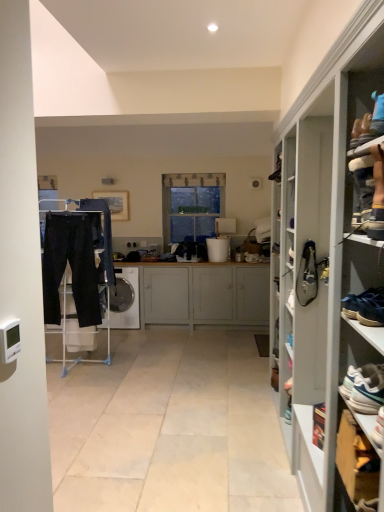
Find the location of `clear glass window at center`. clear glass window at center is located at coordinates (191, 205).

This screenshot has width=384, height=512. What do you see at coordinates (132, 304) in the screenshot?
I see `white glossy dishwasher at center` at bounding box center [132, 304].

This screenshot has height=512, width=384. I want to click on white matte cabinet at center, so click(204, 294).

You are a GUI agent. You are given a task and a screenshot of the screen. Output one action in this format:
    pyautogui.click(x=<x>, y=<y>)
    Task: Click on the black leather shoe at right, acting as the first shoe starting from the top
    
    Given the screenshot: What is the action you would take?
    pyautogui.click(x=307, y=275)

Looking at this image, which object is closer to the camera taking this photo, white matte cabinet at center or wooden cabinet at lower right?

Positioned in front is wooden cabinet at lower right.

From a real-world perspective, relative to wooden cabinet at lower right, is white matte cabinet at center vertically above or below?

white matte cabinet at center is situated lower than wooden cabinet at lower right in the real world.

How much distance is there between white matte cabinet at center and wooden cabinet at lower right?

white matte cabinet at center is 3.81 meters away from wooden cabinet at lower right.

From the picture: Between white matte cabinet at center and wooden cabinet at lower right, which one has smaller width?

wooden cabinet at lower right is thinner.

From a real-world perspective, who is located lower, white leather sneaker at lower right, the second shoe viewed from the top, or white glossy cupboard at right?

white leather sneaker at lower right, the second shoe viewed from the top, from a real-world perspective.

Considering the sizes of white leather sneaker at lower right, the second shoe viewed from the top, and white glossy cupboard at right in the image, is white leather sneaker at lower right, the second shoe viewed from the top, wider or thinner than white glossy cupboard at right?

Clearly, white leather sneaker at lower right, the second shoe viewed from the top, has less width compared to white glossy cupboard at right.

Considering the sizes of white leather sneaker at lower right, the first shoe in the bottom-to-top sequence, and white glossy cupboard at right in the image, is white leather sneaker at lower right, the first shoe in the bottom-to-top sequence, bigger or smaller than white glossy cupboard at right?

white leather sneaker at lower right, the first shoe in the bottom-to-top sequence, is smaller than white glossy cupboard at right.

Would you consider white leather sneaker at lower right, which appears as the first shoe when viewed from the front, to be distant from white glossy cupboard at right?

Yes, white leather sneaker at lower right, which appears as the first shoe when viewed from the front, is far from white glossy cupboard at right.

Which object is closer to the camera, white glossy dishwasher at center or white glossy cupboard at right?

white glossy cupboard at right is closer to the camera.

Does white glossy dishwasher at center have a lesser height compared to white glossy cupboard at right?

Yes.

The width and height of the screenshot is (384, 512). Identify the location of dish washer located on the left of white glossy cupboard at right. (132, 304).

Is white glossy dishwasher at center aimed at white glossy cupboard at right?

No, white glossy dishwasher at center is not aimed at white glossy cupboard at right.

Who is bigger, white glossy dishwasher at center or wooden cabinet at lower right?

Bigger between the two is white glossy dishwasher at center.

Is white glossy dishwasher at center aimed at wooden cabinet at lower right?

No, white glossy dishwasher at center is not turned towards wooden cabinet at lower right.

Looking at this image, is white glossy dishwasher at center at the left side of wooden cabinet at lower right?

Indeed, white glossy dishwasher at center is positioned on the left side of wooden cabinet at lower right.

Considering the points (346, 461) and (136, 270), which point is in front, point (346, 461) or point (136, 270)?

The point (346, 461) is more forward.

How much distance is there between wooden cabinet at lower right and white glossy dishwasher at center?

wooden cabinet at lower right is 3.89 meters from white glossy dishwasher at center.

Which of these two, wooden cabinet at lower right or white glossy dishwasher at center, is wider?

white glossy dishwasher at center.

Is wooden cabinet at lower right shorter than white glossy dishwasher at center?

Yes.

Is clear glass window at center wider than wooden cabinet at lower right?

Incorrect, the width of clear glass window at center does not surpass that of wooden cabinet at lower right.

From the image's perspective, would you say clear glass window at center is shown under wooden cabinet at lower right?

Actually, clear glass window at center appears above wooden cabinet at lower right in the image.

Is clear glass window at center bigger than wooden cabinet at lower right?

Indeed, clear glass window at center has a larger size compared to wooden cabinet at lower right.

Does clear glass window at center appear on the right side of wooden cabinet at lower right?

Incorrect, clear glass window at center is not on the right side of wooden cabinet at lower right.

From the image's perspective, relative to clear glass window at center, is black cotton trousers at left above or below?

black cotton trousers at left is situated lower than clear glass window at center in the image.

Looking at their sizes, would you say black cotton trousers at left is wider or thinner than clear glass window at center?

Considering their sizes, black cotton trousers at left looks broader than clear glass window at center.

Is black cotton trousers at left looking in the opposite direction of clear glass window at center?

No, black cotton trousers at left is not facing away from clear glass window at center.

Find the location of a particular element. The image size is (384, 512). cabinetry that appears below the wooden cabinet at lower right (from a real-world perspective) is located at coordinates (204, 294).

Locate an element on the screen. Image resolution: width=384 pixels, height=512 pixels. the 2nd shoe to the left of the white glossy cupboard at right, starting your count from the anchor is located at coordinates (378, 428).

From the image, which object appears to be nearer to white matte cabinet at center, white glossy dishwasher at center or white leather sneaker at lower right, the second shoe viewed from the top?

white glossy dishwasher at center.

Based on their spatial positions, is white glossy dishwasher at center or white glossy trash can at center closer to white matte cabinet at center?

white glossy trash can at center.

Which object lies nearer to the anchor point wooden cabinet at lower right, black leather shoe at right, positioned as the 2th shoe in bottom-to-top order, or white leather sneaker at lower right, which appears as the first shoe when viewed from the front?

white leather sneaker at lower right, which appears as the first shoe when viewed from the front.

From the picture: Based on their spatial positions, is white leather sneaker at lower right, the first shoe in the bottom-to-top sequence, or white glossy cupboard at right closer to black leather shoe at right, which appears as the 2th shoe when viewed from the front?

The object closer to black leather shoe at right, which appears as the 2th shoe when viewed from the front, is white glossy cupboard at right.

When comparing their distances from clear glass window at center, does white leather sneaker at lower right, acting as the 2th shoe starting from the back, or white glossy trash can at center seem closer?

Among the two, white glossy trash can at center is located nearer to clear glass window at center.

Estimate the real-world distances between objects in this image. Which object is further from white matte cabinet at center, black leather shoe at right, positioned as the 2th shoe in bottom-to-top order, or white glossy dishwasher at center?

black leather shoe at right, positioned as the 2th shoe in bottom-to-top order.

Based on the photo, which object lies further to the anchor point white matte cabinet at center, white leather sneaker at lower right, the first shoe in the bottom-to-top sequence, or wooden cabinet at lower right?

Based on the image, white leather sneaker at lower right, the first shoe in the bottom-to-top sequence, appears to be further to white matte cabinet at center.

Which object lies further to the anchor point white glossy cupboard at right, white leather sneaker at lower right, the first shoe in the bottom-to-top sequence, or clear glass window at center?

clear glass window at center is further to white glossy cupboard at right.

At what (x,y) coordinates should I click in order to perform the action: click on trousers between white leather sneaker at lower right, the first shoe in the bottom-to-top sequence, and white matte cabinet at center in the front-back direction. Please return your answer as a coordinate pair (x, y). Image resolution: width=384 pixels, height=512 pixels. Looking at the image, I should click on (70, 266).

Find the location of a particular element. cabinet between white leather sneaker at lower right, acting as the 2th shoe starting from the back, and white glossy trash can at center from front to back is located at coordinates (356, 461).

I want to click on appliance positioned between wooden cabinet at lower right and white glossy dishwasher at center from near to far, so click(218, 249).

Identify the location of dish washer located between black leather shoe at right, acting as the first shoe starting from the top, and clear glass window at center in the depth direction. The image size is (384, 512). (132, 304).